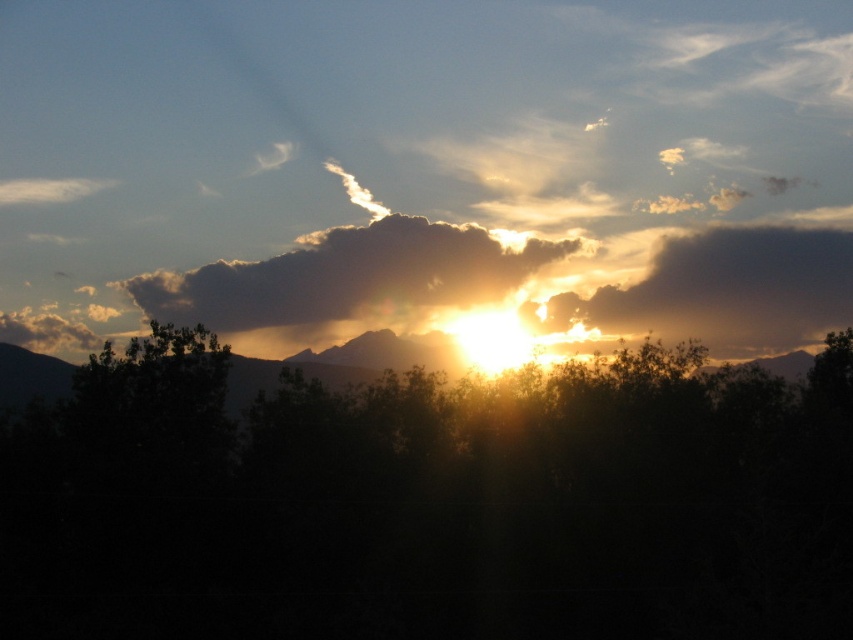
Looking at the sunset scene, there are two golden translucent clouds in the sky. Which one is positioned to the left between the golden translucent cloud at center and the golden translucent cloud at upper right?

The golden translucent cloud at center is positioned to the left of the golden translucent cloud at upper right.

You are a bird flying between the two golden translucent clouds. The distance between them is critical for your flight path. Can you safely navigate the space between the golden translucent cloud at center and the golden translucent cloud at upper right without getting too close?

The golden translucent cloud at center and the golden translucent cloud at upper right are 20.97 feet apart from each other. This distance should be sufficient for the bird to navigate safely between them, provided it maintains a flight path that keeps it at least a few feet away from each cloud to avoid any potential obstacles or turbulence.